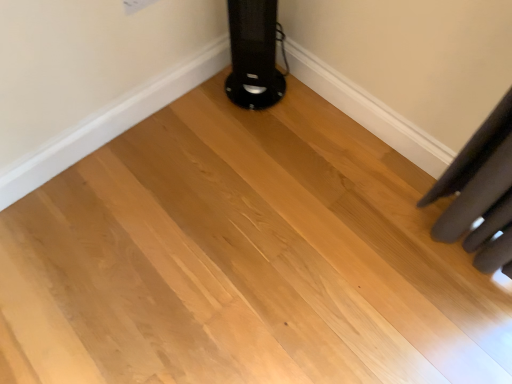
I want to click on vacant area situated to the left side of black plastic speaker at center, so click(199, 96).